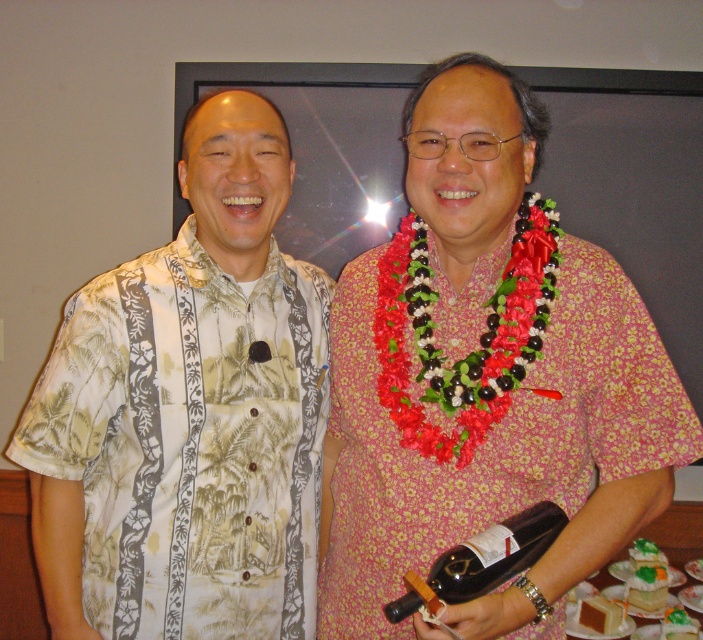
Who is higher up, white floral shirt at left or black glass bottle at lower center?

Positioned higher is white floral shirt at left.

Who is more forward, (146, 307) or (456, 554)?

Point (456, 554) is more forward.

This screenshot has height=640, width=703. What are the coordinates of `white floral shirt at left` in the screenshot? It's located at (188, 413).